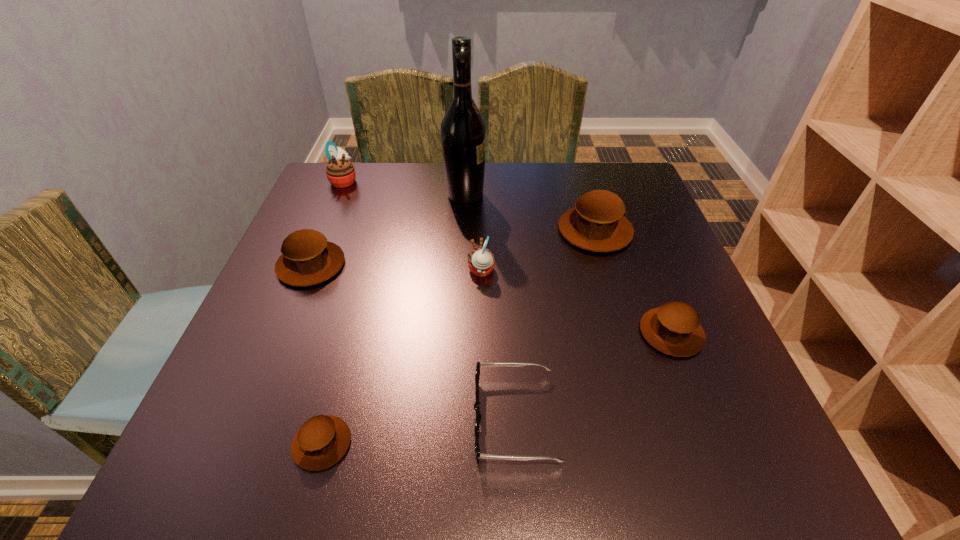
Locate an element on the screen. the smallest brown muffin is located at coordinates (323, 440).

Find the location of a particular element. The image size is (960, 540). the shortest muffin is located at coordinates (323, 440).

This screenshot has height=540, width=960. What are the coordinates of `spectacles` in the screenshot? It's located at [x=477, y=374].

The height and width of the screenshot is (540, 960). In order to click on vacant space located on the label of the wine bottle in this screenshot , I will do `click(523, 195)`.

Find the location of a particular element. This screenshot has height=540, width=960. vacant space situated on the front-facing side of the farther pink muffin is located at coordinates (490, 181).

You are a GUI agent. You are given a task and a screenshot of the screen. Output one action in this format:
    pyautogui.click(x=<x>, y=<y>)
    Task: Click on the free space located 0.080m on the right of the biggest brown muffin
    This screenshot has width=960, height=540.
    Given the screenshot: What is the action you would take?
    pyautogui.click(x=664, y=231)

Identify the location of free spot located on the front-facing side of the nearer pink muffin. (444, 271).

I want to click on free space located 0.280m on the front-facing side of the nearer pink muffin, so click(341, 271).

The height and width of the screenshot is (540, 960). Find the location of `vacant area located 0.290m on the front-facing side of the nearer pink muffin`. vacant area located 0.290m on the front-facing side of the nearer pink muffin is located at coordinates (336, 271).

Where is `free region located on the back of the leftmost brown muffin`? free region located on the back of the leftmost brown muffin is located at coordinates (325, 231).